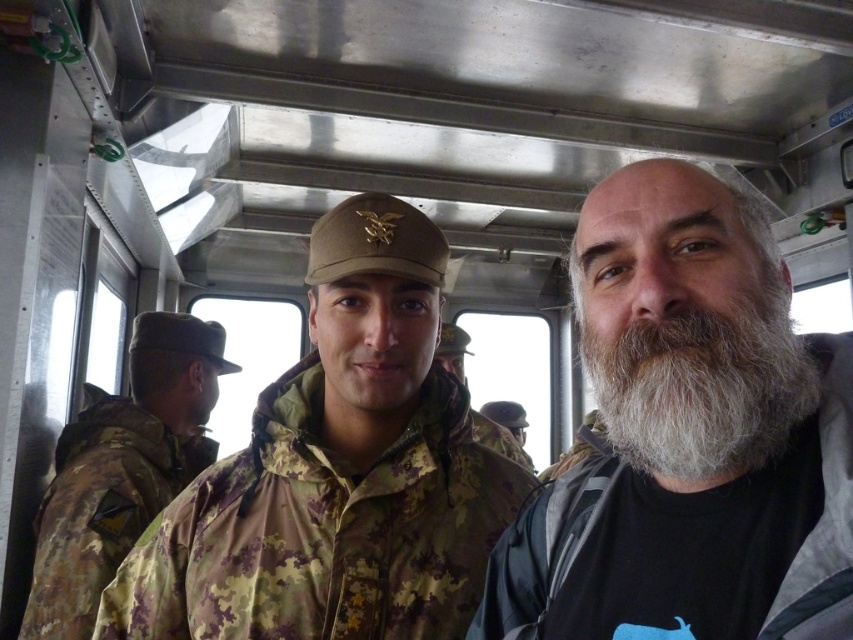
Question: Can you confirm if white beard at center is smaller than camouflage fabric uniform at center?

Choices:
 (A) no
 (B) yes

Answer: (A)

Question: Among these objects, which one is farthest from the camera?

Choices:
 (A) camouflage fabric jacket at center
 (B) camouflage uniform at left
 (C) white fuzzy beard at center

Answer: (B)

Question: Estimate the real-world distances between objects in this image. Which object is closer to the white beard at center?

Choices:
 (A) camouflage fabric jacket at center
 (B) white fuzzy beard at center
 (C) camouflage fabric uniform at center
 (D) camouflage uniform at left

Answer: (B)

Question: Which object is farther from the camera taking this photo?

Choices:
 (A) camouflage uniform at left
 (B) camouflage uniform at center
 (C) camouflage fabric jacket at center

Answer: (B)

Question: Is the position of camouflage uniform at left more distant than that of camouflage fabric uniform at center?

Choices:
 (A) no
 (B) yes

Answer: (A)

Question: Does white beard at center have a greater width compared to camouflage uniform at left?

Choices:
 (A) yes
 (B) no

Answer: (B)